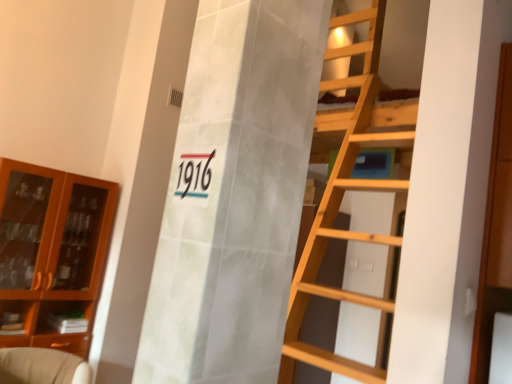
Question: Considering the relative sizes of black glossy number at center and beige fabric armchair at lower left in the image provided, is black glossy number at center bigger than beige fabric armchair at lower left?

Choices:
 (A) yes
 (B) no

Answer: (B)

Question: Is the position of black glossy number at center more distant than that of beige fabric armchair at lower left?

Choices:
 (A) no
 (B) yes

Answer: (A)

Question: Considering the relative sizes of black glossy number at center and beige fabric armchair at lower left in the image provided, is black glossy number at center thinner than beige fabric armchair at lower left?

Choices:
 (A) no
 (B) yes

Answer: (B)

Question: Is beige fabric armchair at lower left inside black glossy number at center?

Choices:
 (A) yes
 (B) no

Answer: (B)

Question: From a real-world perspective, is black glossy number at center positioned under beige fabric armchair at lower left based on gravity?

Choices:
 (A) no
 (B) yes

Answer: (A)

Question: Considering the relative positions of black glossy number at center and beige fabric armchair at lower left in the image provided, is black glossy number at center to the right of beige fabric armchair at lower left from the viewer's perspective?

Choices:
 (A) yes
 (B) no

Answer: (A)

Question: Considering the relative sizes of brown glass cabinet at left, arranged as the 2th cabinetry when viewed from the right, and beige fabric armchair at lower left in the image provided, is brown glass cabinet at left, arranged as the 2th cabinetry when viewed from the right, taller than beige fabric armchair at lower left?

Choices:
 (A) no
 (B) yes

Answer: (B)

Question: Is brown glass cabinet at left, which appears as the second cabinetry when viewed from the front, placed right next to beige fabric armchair at lower left?

Choices:
 (A) yes
 (B) no

Answer: (B)

Question: Does brown glass cabinet at left, which appears as the 1th cabinetry when viewed from the back, appear on the right side of beige fabric armchair at lower left?

Choices:
 (A) no
 (B) yes

Answer: (A)

Question: Considering the relative sizes of brown glass cabinet at left, arranged as the 2th cabinetry when viewed from the right, and beige fabric armchair at lower left in the image provided, is brown glass cabinet at left, arranged as the 2th cabinetry when viewed from the right, smaller than beige fabric armchair at lower left?

Choices:
 (A) no
 (B) yes

Answer: (A)

Question: Could beige fabric armchair at lower left be considered to be inside brown glass cabinet at left, positioned as the first cabinetry in left-to-right order?

Choices:
 (A) no
 (B) yes

Answer: (A)

Question: Does brown glass cabinet at left, which appears as the second cabinetry when viewed from the front, appear on the left side of beige fabric armchair at lower left?

Choices:
 (A) no
 (B) yes

Answer: (B)

Question: Can you confirm if wooden cabinet at right, arranged as the 2th cabinetry when viewed from the left, is positioned to the right of black glossy number at center?

Choices:
 (A) no
 (B) yes

Answer: (B)